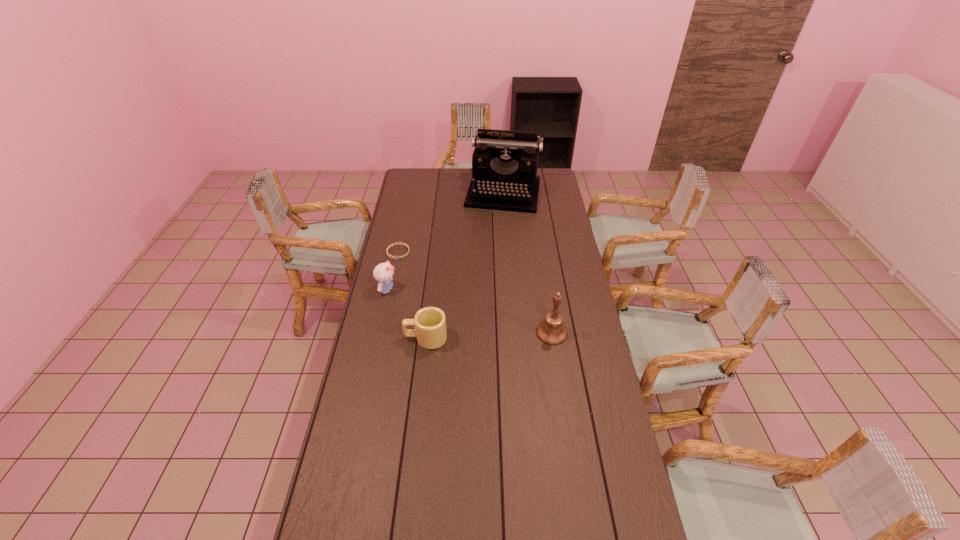
The image size is (960, 540). Identify the location of vacant space located 0.130m with the handle on the side of the third object from right to left. (371, 338).

Where is `vacant space positioned 0.120m with the handle on the side of the third object from right to left`? This screenshot has height=540, width=960. vacant space positioned 0.120m with the handle on the side of the third object from right to left is located at coordinates (373, 338).

What are the coordinates of `free space located 0.060m on the right of the bell` in the screenshot? It's located at (583, 333).

In order to click on free space located 0.120m on the front-facing side of the kitten in this screenshot , I will do tap(420, 303).

Identify the location of vacant space located 0.340m on the front-facing side of the kitten. The width and height of the screenshot is (960, 540). (466, 321).

Find the location of a particular element. The height and width of the screenshot is (540, 960). vacant space located 0.350m on the front-facing side of the kitten is located at coordinates (468, 322).

This screenshot has height=540, width=960. I want to click on free space located 0.350m on the typing side of the farthest object, so click(490, 255).

Where is `blank space located 0.390m on the typing side of the farthest object`? This screenshot has height=540, width=960. blank space located 0.390m on the typing side of the farthest object is located at coordinates (489, 261).

The image size is (960, 540). What are the coordinates of `vacant space located 0.380m on the typing side of the farthest object` in the screenshot? It's located at (489, 259).

You are a GUI agent. You are given a task and a screenshot of the screen. Output one action in this format:
    pyautogui.click(x=<x>, y=<y>)
    Task: Click on the vacant point located on the surface of the fourth nearest object showing star-shaped elements
    
    Given the screenshot: What is the action you would take?
    pyautogui.click(x=423, y=271)